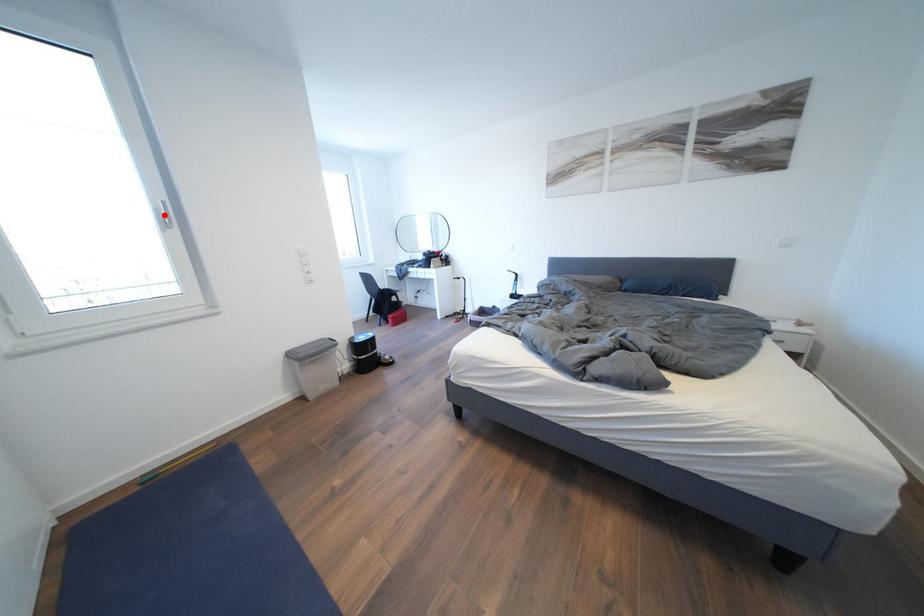
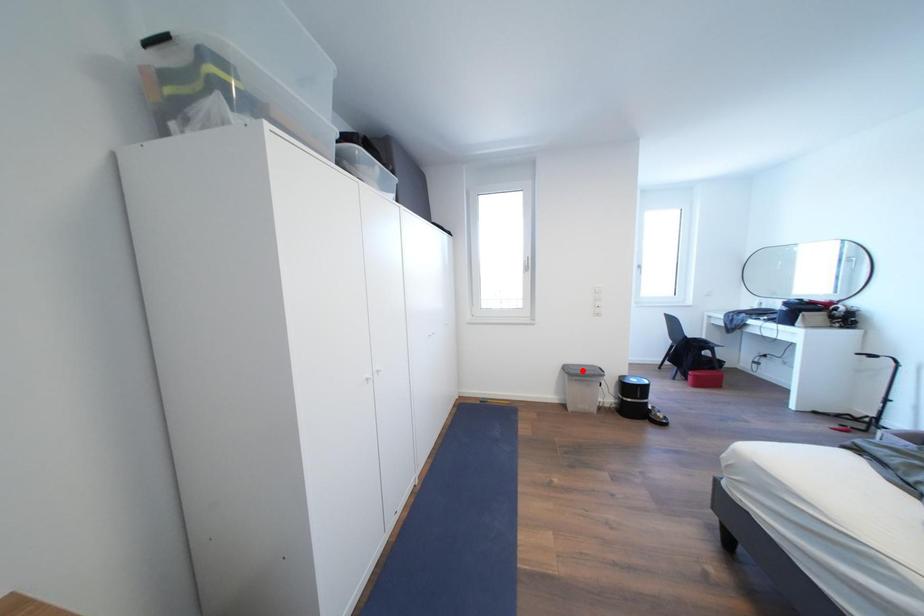
I am providing you with two images of the same scene from different viewpoints. A red point is marked on the first image and another point is marked on the second image. Do the highlighted points in image1 and image2 indicate the same real-world spot?

No